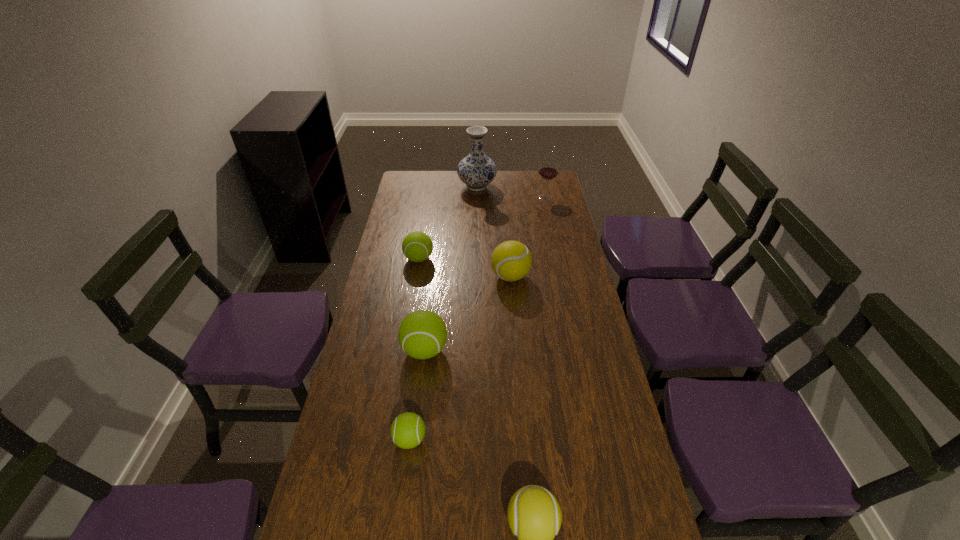
Where is `vase`? vase is located at coordinates (476, 170).

Find the location of a particular element. Image resolution: width=960 pixels, height=540 pixels. blue vase is located at coordinates (476, 170).

Where is `the rightmost object`? The image size is (960, 540). the rightmost object is located at coordinates (548, 170).

At what (x,y) coordinates should I click in order to perform the action: click on wineglass. Please return your answer as a coordinate pair (x, y). Looking at the image, I should click on (548, 170).

Locate an element on the screen. The image size is (960, 540). the bigger yellow tennis ball is located at coordinates (511, 260).

Find the location of a particular element. The height and width of the screenshot is (540, 960). the second farthest green tennis ball is located at coordinates (422, 334).

Identify the location of the biggest green tennis ball. (422, 334).

Find the location of a particular element. the farthest green tennis ball is located at coordinates (417, 246).

This screenshot has width=960, height=540. Find the location of `the shortest object`. the shortest object is located at coordinates (407, 431).

Where is `the nearest green tennis ball`? the nearest green tennis ball is located at coordinates (407, 431).